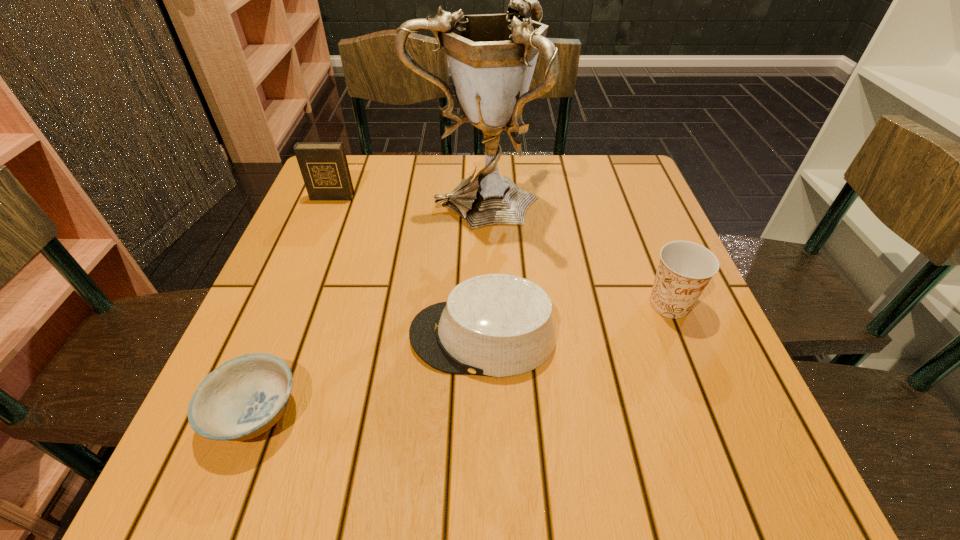
You are a GUI agent. You are given a task and a screenshot of the screen. Output one action in this format:
    pyautogui.click(x=<x>, y=<y>)
    Task: Click on the vacant space that's between the shortest object and the hat
    This screenshot has width=960, height=540.
    Given the screenshot: What is the action you would take?
    pyautogui.click(x=369, y=374)

At what (x,y) coordinates should I click in order to perform the action: click on vacant space that's between the bowl and the second shortest object. Please return your answer as a coordinate pair (x, y). The height and width of the screenshot is (540, 960). Looking at the image, I should click on (369, 374).

Locate an element on the screen. unoccupied area between the fourth tallest object and the tallest object is located at coordinates (480, 269).

Find the location of a particular element. vacant area between the diary and the rightmost object is located at coordinates (501, 251).

At what (x,y) coordinates should I click in order to perform the action: click on vacant region between the trophy cup and the fourth tallest object. Please return your answer as a coordinate pair (x, y). This screenshot has height=540, width=960. Looking at the image, I should click on (480, 269).

Locate an element on the screen. The image size is (960, 540). free space between the fourth tallest object and the tallest object is located at coordinates (480, 269).

Find the location of a particular element. object that stands as the second closest to the trophy cup is located at coordinates 497,325.

Find the location of `object that stands as the closest to the bowl`. object that stands as the closest to the bowl is located at coordinates (497, 325).

You are a GUI agent. You are given a task and a screenshot of the screen. Output one action in this format:
    pyautogui.click(x=<x>, y=<y>)
    Task: Click on the free space that satisfies the following two spatial constraints: 1. on the front cover of the tallest object; 2. on the right side of the diary
    The image size is (960, 540).
    Given the screenshot: What is the action you would take?
    pyautogui.click(x=330, y=201)

The height and width of the screenshot is (540, 960). Identify the location of vacant point that satisfies the following two spatial constraints: 1. on the front cover of the Dixie cup; 2. on the left side of the diary. (288, 303).